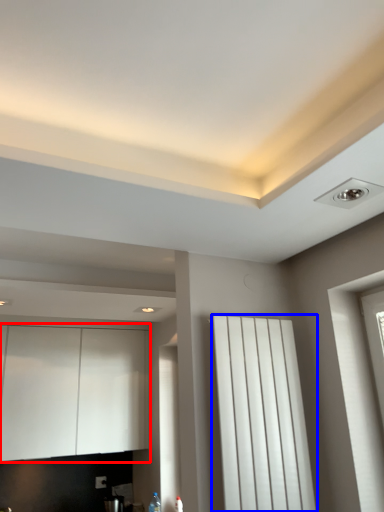
Question: Among these objects, which one is farthest to the camera, cabinetry (highlighted by a red box) or curtain (highlighted by a blue box)?

Choices:
 (A) cabinetry
 (B) curtain

Answer: (A)